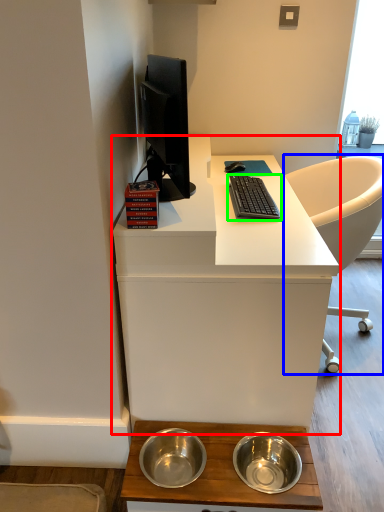
Question: Based on their relative distances, which object is farther from desk (highlighted by a red box)? Choose from chair (highlighted by a blue box) and computer keyboard (highlighted by a green box).

Choices:
 (A) chair
 (B) computer keyboard

Answer: (A)